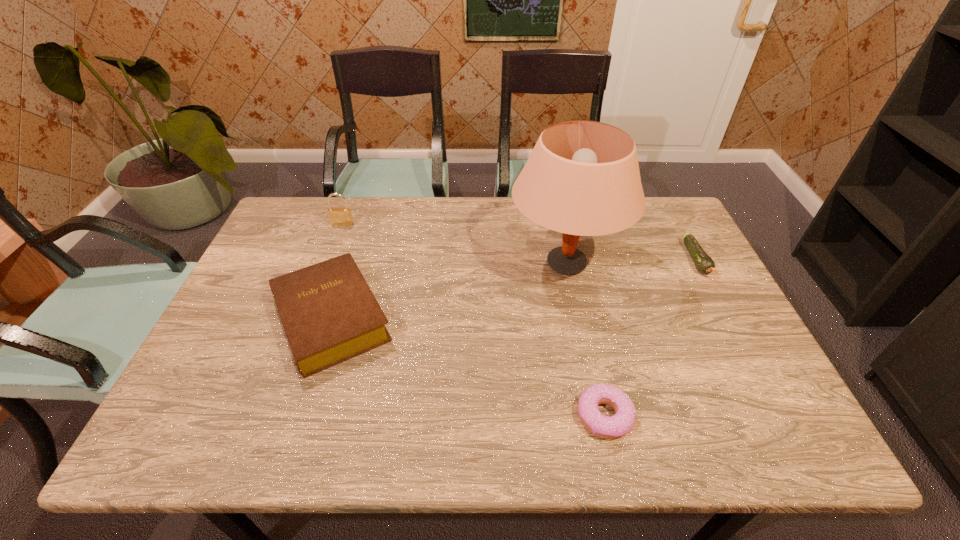
Locate an element on the screen. This screenshot has height=540, width=960. lampshade is located at coordinates (582, 178).

What are the coordinates of `the fourth shortest object` in the screenshot? It's located at (339, 216).

Identify the location of padlock. (339, 216).

Find the location of a particular element. The height and width of the screenshot is (540, 960). the third tallest object is located at coordinates (330, 315).

Locate an element on the screen. This screenshot has width=960, height=540. the rightmost object is located at coordinates pyautogui.click(x=703, y=262).

Identify the location of doughnut. (616, 426).

Find the location of a particular element. This screenshot has width=960, height=540. free space located 0.400m on the front-facing side of the lampshade is located at coordinates (372, 263).

Identify the location of vacant space located 0.130m on the front-facing side of the lampshade. This screenshot has height=540, width=960. (464, 263).

You are a GUI agent. You are given a task and a screenshot of the screen. Output one action in this format:
    pyautogui.click(x=<x>, y=<y>)
    Task: Click on the vacant area situated on the front-facing side of the lampshade
    The width and height of the screenshot is (960, 540).
    Given the screenshot: What is the action you would take?
    pyautogui.click(x=477, y=263)

Locate an element on the screen. This screenshot has width=960, height=540. free spot located 0.320m on the front-facing side of the second tallest object is located at coordinates (315, 298).